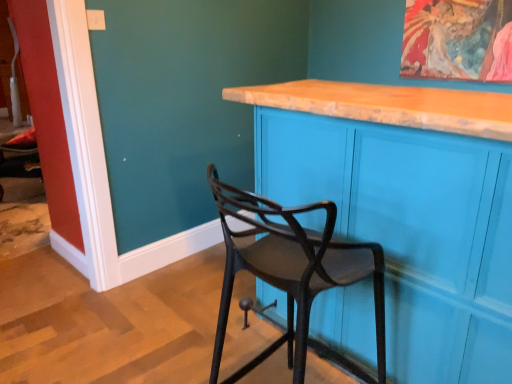
Question: From the image's perspective, would you say matte black chair at center is positioned over matte blue cabinet at center?

Choices:
 (A) no
 (B) yes

Answer: (A)

Question: Does matte black chair at center have a lesser width compared to matte blue cabinet at center?

Choices:
 (A) no
 (B) yes

Answer: (B)

Question: Is matte black chair at center not within matte blue cabinet at center?

Choices:
 (A) yes
 (B) no

Answer: (A)

Question: Is matte black chair at center oriented towards matte blue cabinet at center?

Choices:
 (A) yes
 (B) no

Answer: (A)

Question: Does matte black chair at center have a greater width compared to matte blue cabinet at center?

Choices:
 (A) yes
 (B) no

Answer: (B)

Question: From a real-world perspective, is matte black chair at center physically above matte blue cabinet at center?

Choices:
 (A) yes
 (B) no

Answer: (B)

Question: Is matte blue cabinet at center completely or partially outside of matte black chair at center?

Choices:
 (A) yes
 (B) no

Answer: (A)

Question: Can matte black chair at center be found inside matte blue cabinet at center?

Choices:
 (A) yes
 (B) no

Answer: (B)

Question: From a real-world perspective, is matte blue cabinet at center beneath matte black chair at center?

Choices:
 (A) no
 (B) yes

Answer: (A)

Question: From the image's perspective, is matte blue cabinet at center over matte black chair at center?

Choices:
 (A) yes
 (B) no

Answer: (A)

Question: From a real-world perspective, is matte blue cabinet at center over matte black chair at center?

Choices:
 (A) yes
 (B) no

Answer: (A)

Question: Considering the relative sizes of matte blue cabinet at center and matte black chair at center in the image provided, is matte blue cabinet at center bigger than matte black chair at center?

Choices:
 (A) yes
 (B) no

Answer: (A)

Question: Considering the relative positions of matte black chair at center and matte blue cabinet at center in the image provided, is matte black chair at center to the left or to the right of matte blue cabinet at center?

Choices:
 (A) right
 (B) left

Answer: (B)